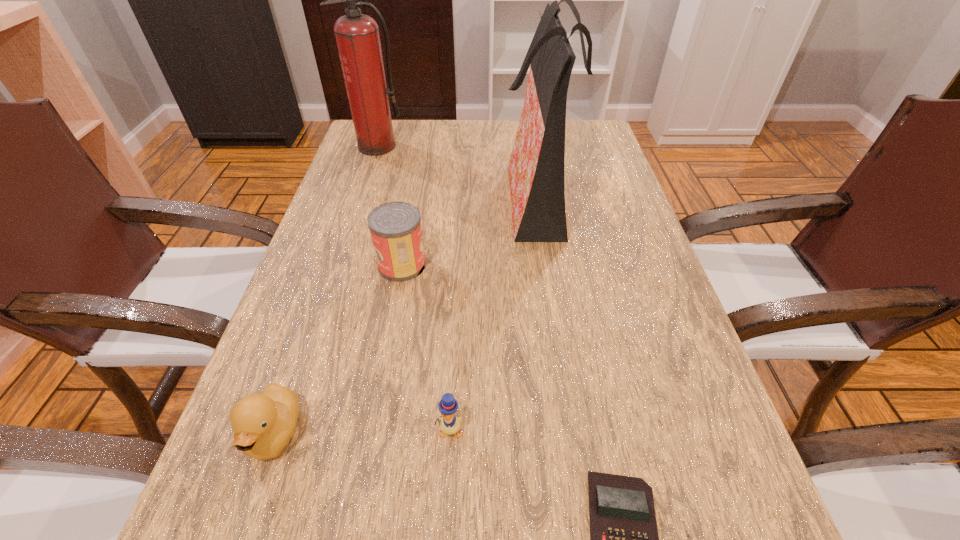
Image resolution: width=960 pixels, height=540 pixels. Find the location of `free space between the shopping bag and the right duckling`. free space between the shopping bag and the right duckling is located at coordinates (493, 313).

Identify which object is located as the third nearest to the taller duckling. Please provide its 2D coordinates. Your answer should be formatted as a tuple, i.e. [(x, y)], where the tuple contains the x and y coordinates of a point satisfying the conditions above.

[(624, 539)]

Identify which object is the fifth nearest to the nearest object. Please provide its 2D coordinates. Your answer should be formatted as a tuple, i.e. [(x, y)], where the tuple contains the x and y coordinates of a point satisfying the conditions above.

[(357, 35)]

The width and height of the screenshot is (960, 540). I want to click on blank space that satisfies the following two spatial constraints: 1. at the nozzle of the fire extinguisher; 2. on the right side of the third object from left to right, so click(x=339, y=265).

Where is `free point that satisfies the following two spatial constraints: 1. on the front side of the fifth nearest object; 2. facing forward on the taller duckling`? Image resolution: width=960 pixels, height=540 pixels. free point that satisfies the following two spatial constraints: 1. on the front side of the fifth nearest object; 2. facing forward on the taller duckling is located at coordinates (575, 434).

The width and height of the screenshot is (960, 540). In order to click on free space that satisfies the following two spatial constraints: 1. on the front side of the fifth nearest object; 2. facing forward on the taller duckling in this screenshot , I will do `click(575, 434)`.

The image size is (960, 540). I want to click on vacant space that satisfies the following two spatial constraints: 1. at the nozzle of the fourth shortest object; 2. on the left side of the fire extinguisher, so click(x=339, y=265).

You are a GUI agent. You are given a task and a screenshot of the screen. Output one action in this format:
    pyautogui.click(x=<x>, y=<y>)
    Task: Click on the free space that satisfies the following two spatial constraints: 1. on the front side of the shopping bag; 2. on the face of the second shortest object, where the monocle is placed
    
    Given the screenshot: What is the action you would take?
    pyautogui.click(x=574, y=430)